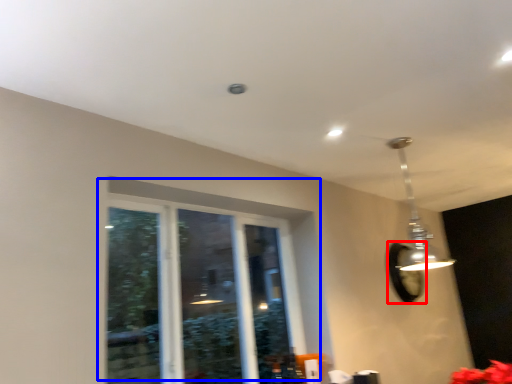
Question: Which object is further to the camera taking this photo, mirror (highlighted by a red box) or window (highlighted by a blue box)?

Choices:
 (A) mirror
 (B) window

Answer: (A)